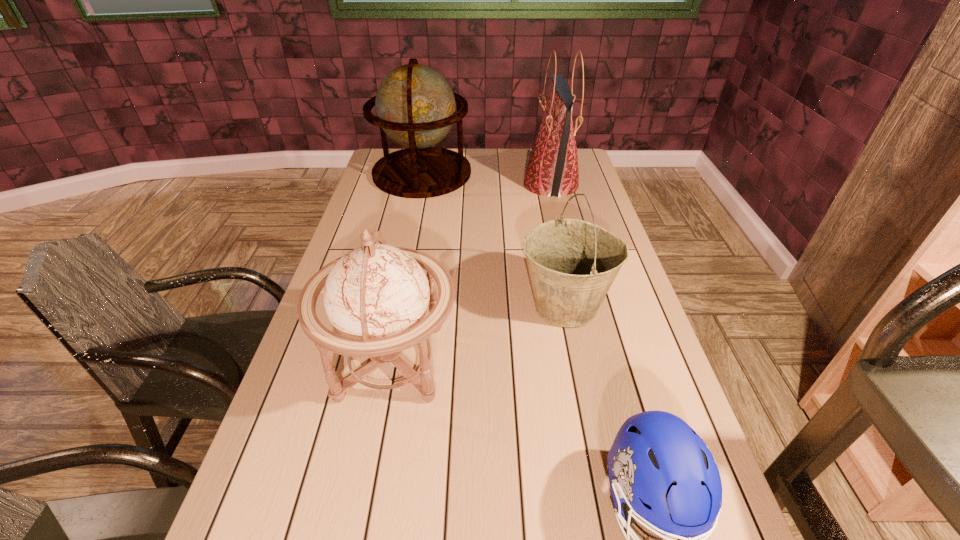
Identify which object is the fourth nearest to the nearest object. Please provide its 2D coordinates. Your answer should be formatted as a tuple, i.e. [(x, y)], where the tuple contains the x and y coordinates of a point satisfying the conditions above.

[(415, 106)]

You are a GUI agent. You are given a task and a screenshot of the screen. Output one action in this format:
    pyautogui.click(x=<x>, y=<y>)
    Task: Click on the vacant space that satisfies the following two spatial constraints: 1. on the front side of the handbag; 2. at the front of the nearer globe showing Africa
    This screenshot has height=540, width=960.
    Given the screenshot: What is the action you would take?
    pyautogui.click(x=594, y=361)

Image resolution: width=960 pixels, height=540 pixels. Find the location of `blank space that satisfies the following two spatial constraints: 1. on the front-facing side of the farther globe; 2. on the left side of the wine bucket`. blank space that satisfies the following two spatial constraints: 1. on the front-facing side of the farther globe; 2. on the left side of the wine bucket is located at coordinates (395, 306).

Identify the location of free space that satisfies the following two spatial constraints: 1. on the front-facing side of the farther globe; 2. on the left side of the wine bucket. The height and width of the screenshot is (540, 960). (395, 306).

Where is `vacant space that satisfies the following two spatial constraints: 1. on the front-facing side of the handbag; 2. on the left side of the farther globe`? This screenshot has height=540, width=960. vacant space that satisfies the following two spatial constraints: 1. on the front-facing side of the handbag; 2. on the left side of the farther globe is located at coordinates (420, 184).